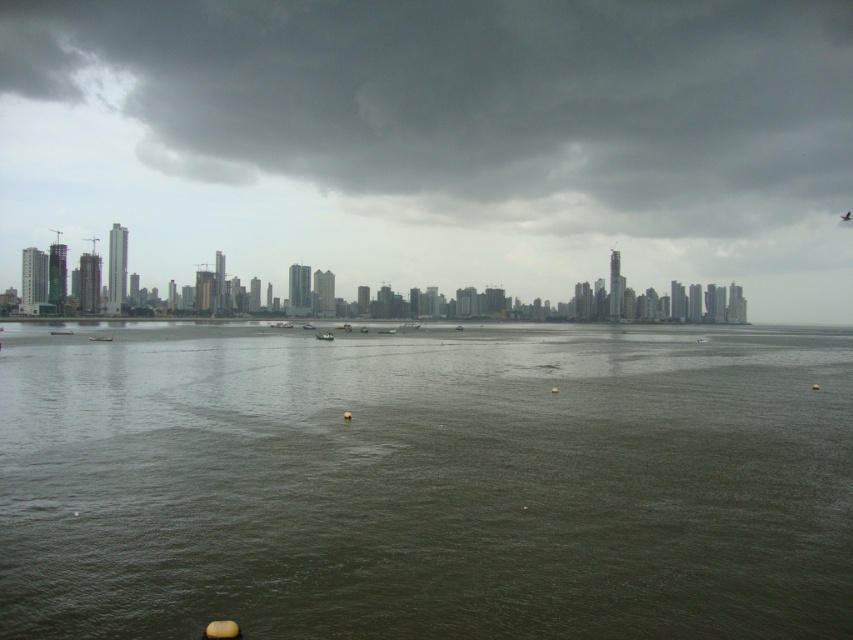
Is dark green water at center to the right of dark gray cloud at upper center from the viewer's perspective?

Correct, you'll find dark green water at center to the right of dark gray cloud at upper center.

Can you confirm if dark green water at center is positioned to the left of dark gray cloud at upper center?

Incorrect, dark green water at center is not on the left side of dark gray cloud at upper center.

Image resolution: width=853 pixels, height=640 pixels. In order to click on dark green water at center in this screenshot , I will do `click(425, 481)`.